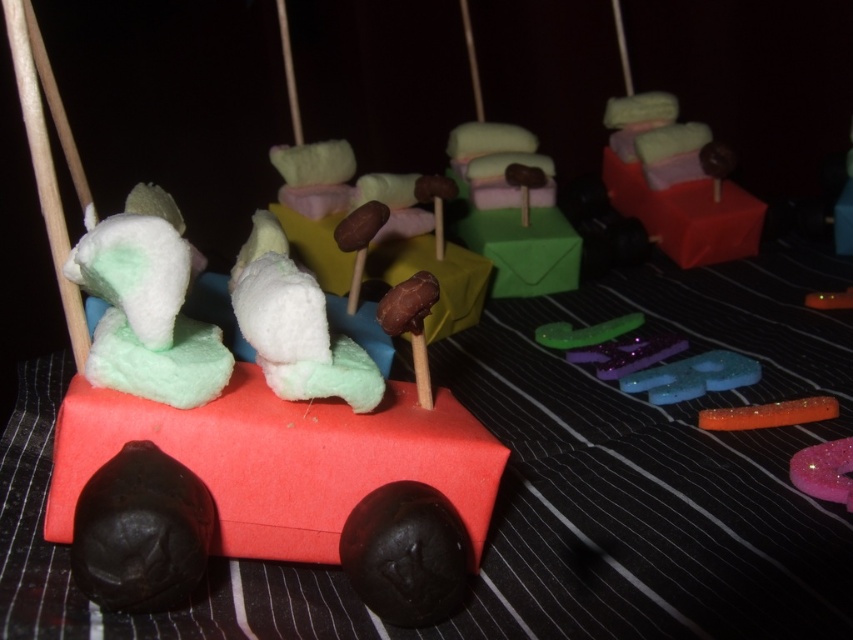
Between white fluffy elephant at center and white marshmallow at center, which one appears on the left side from the viewer's perspective?

Positioned to the left is white fluffy elephant at center.

Is white fluffy elephant at center bigger than white marshmallow at center?

No.

Which is in front, point (93, 246) or point (451, 298)?

Point (93, 246)

Identify the location of white fluffy elephant at center. (148, 305).

Is matte pink candy at upper right wider than glossy orange candy at center?

Correct, the width of matte pink candy at upper right exceeds that of glossy orange candy at center.

Between point (637, 195) and point (770, 420), which one is positioned in front?

Point (770, 420) is in front.

Where is `matte pink candy at upper right`? The image size is (853, 640). matte pink candy at upper right is located at coordinates (674, 182).

Does matte pink candy at upper right appear on the left side of translucent blue glittery star at center?

No, matte pink candy at upper right is not to the left of translucent blue glittery star at center.

In the scene shown: Who is positioned more to the right, matte pink candy at upper right or translucent blue glittery star at center?

From the viewer's perspective, matte pink candy at upper right appears more on the right side.

Who is more forward, (605, 177) or (741, 376)?

Point (741, 376) is more forward.

The image size is (853, 640). I want to click on matte pink candy at upper right, so click(674, 182).